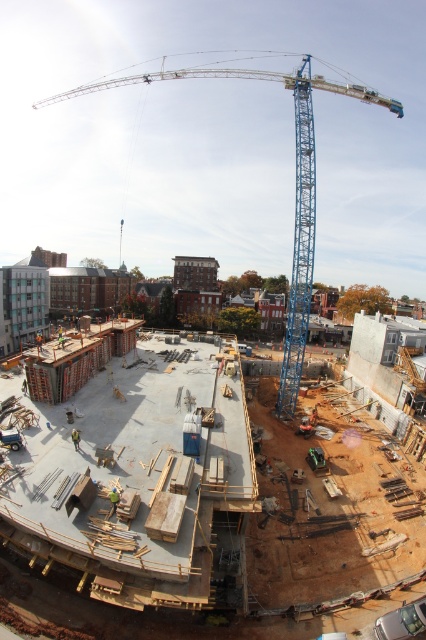
Question: Which point appears closest to the camera in this image?

Choices:
 (A) (296, 342)
 (B) (111, 512)
 (C) (215, 417)
 (D) (77, 436)

Answer: (B)

Question: Estimate the real-world distances between objects in this image. Which object is closer to the green fabric construction worker at center?

Choices:
 (A) yellow reflective vest at center
 (B) concrete slab at center
 (C) blue metallic crane at upper center

Answer: (A)

Question: Which object is the farthest from the concrete slab at center?

Choices:
 (A) green fabric construction worker at center
 (B) blue metallic crane at upper center

Answer: (B)

Question: Is blue metallic crane at upper center wider than green fabric construction worker at center?

Choices:
 (A) yes
 (B) no

Answer: (A)

Question: Is blue metallic crane at upper center wider than green fabric construction worker at center?

Choices:
 (A) yes
 (B) no

Answer: (A)

Question: Does blue metallic crane at upper center have a smaller size compared to green fabric construction worker at center?

Choices:
 (A) no
 (B) yes

Answer: (A)